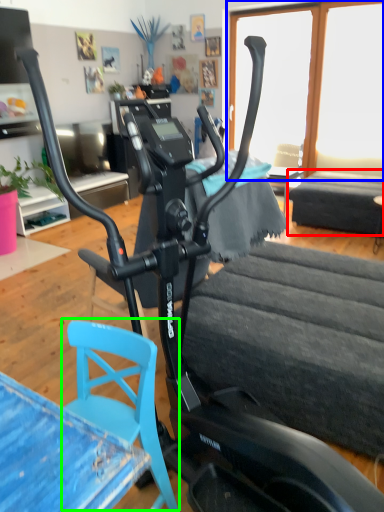
Question: Which object is positioned farthest from table (highlighted by a red box)? Select from window screen (highlighted by a blue box) and swivel chair (highlighted by a green box).

Choices:
 (A) window screen
 (B) swivel chair

Answer: (B)